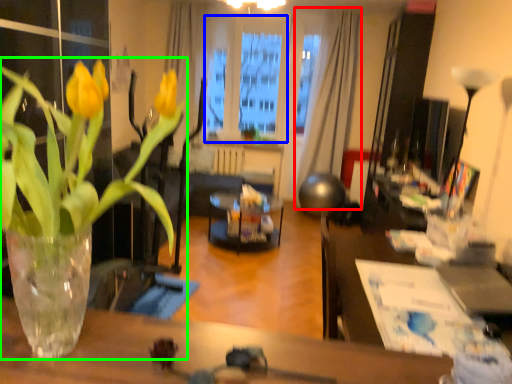
Question: Which is nearer to the curtain (highlighted by a red box)? window screen (highlighted by a blue box) or houseplant (highlighted by a green box).

Choices:
 (A) window screen
 (B) houseplant

Answer: (A)